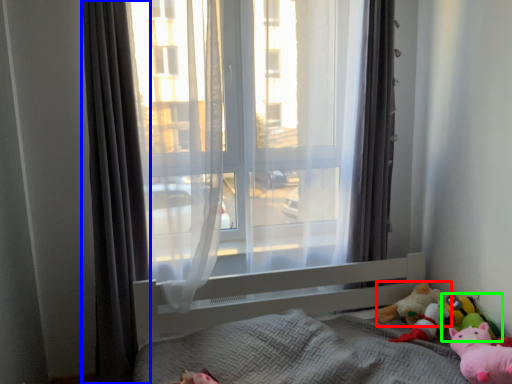
Question: Based on their relative distances, which object is farther from toy (highlighted by a red box)? Choose from curtain (highlighted by a blue box) and toy (highlighted by a green box).

Choices:
 (A) curtain
 (B) toy

Answer: (A)